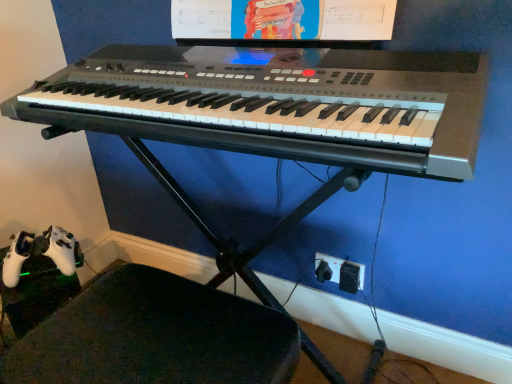
Question: Is black plastic keyboard at center turned away from black leather swivel chair at lower left?

Choices:
 (A) no
 (B) yes

Answer: (A)

Question: Is black plastic keyboard at center to the left of black leather swivel chair at lower left from the viewer's perspective?

Choices:
 (A) yes
 (B) no

Answer: (B)

Question: From the image's perspective, is black plastic keyboard at center beneath black leather swivel chair at lower left?

Choices:
 (A) no
 (B) yes

Answer: (A)

Question: Is black plastic keyboard at center positioned in front of black leather swivel chair at lower left?

Choices:
 (A) no
 (B) yes

Answer: (A)

Question: From a real-world perspective, is black plastic keyboard at center physically below black leather swivel chair at lower left?

Choices:
 (A) no
 (B) yes

Answer: (A)

Question: Is black plastic plug at lower right situated inside matte plastic computer monitor at upper center or outside?

Choices:
 (A) inside
 (B) outside

Answer: (B)

Question: Looking at the image, does black plastic plug at lower right seem bigger or smaller compared to matte plastic computer monitor at upper center?

Choices:
 (A) big
 (B) small

Answer: (B)

Question: From a real-world perspective, is black plastic plug at lower right physically located above or below matte plastic computer monitor at upper center?

Choices:
 (A) above
 (B) below

Answer: (B)

Question: Is black plastic plug at lower right to the left or to the right of matte plastic computer monitor at upper center in the image?

Choices:
 (A) right
 (B) left

Answer: (A)

Question: Visually, is black leather swivel chair at lower left positioned to the left or to the right of black plastic plug at lower right?

Choices:
 (A) left
 (B) right

Answer: (A)

Question: In terms of size, does black leather swivel chair at lower left appear bigger or smaller than black plastic plug at lower right?

Choices:
 (A) small
 (B) big

Answer: (B)

Question: Which is correct: black leather swivel chair at lower left is inside black plastic plug at lower right, or outside of it?

Choices:
 (A) inside
 (B) outside

Answer: (B)

Question: Relative to black plastic plug at lower right, is black leather swivel chair at lower left in front or behind?

Choices:
 (A) behind
 (B) front

Answer: (B)

Question: Would you say black plastic keyboard at center is inside or outside black plastic plug at lower right?

Choices:
 (A) outside
 (B) inside

Answer: (A)

Question: Is point (261, 109) positioned closer to the camera than point (359, 271)?

Choices:
 (A) closer
 (B) farther

Answer: (A)